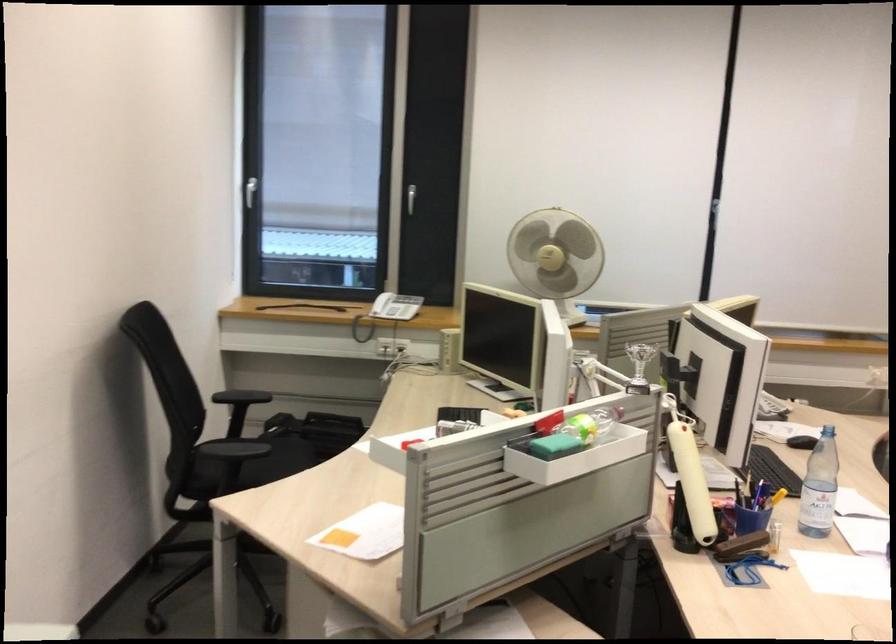
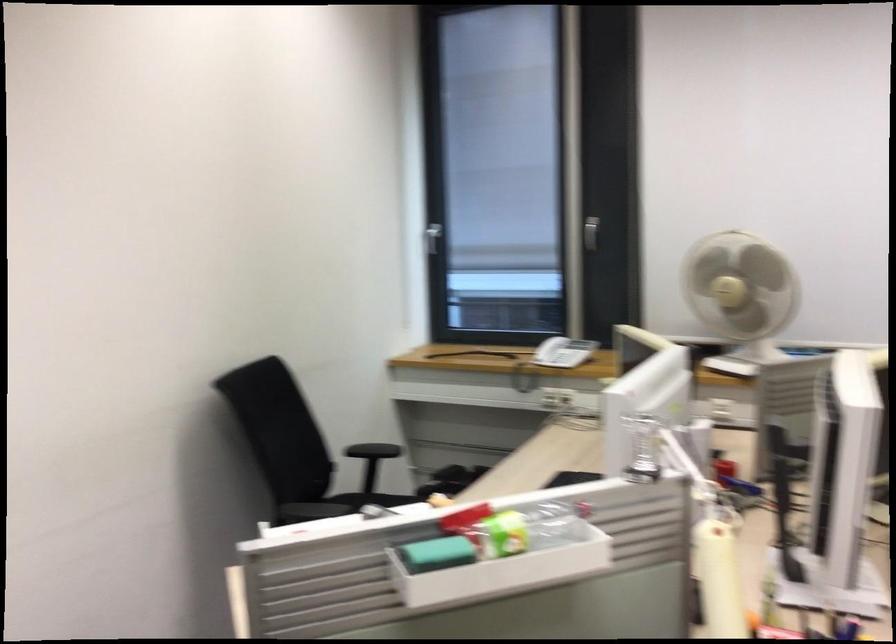
The point at (562, 259) is marked in the first image. Where is the corresponding point in the second image?

(741, 290)